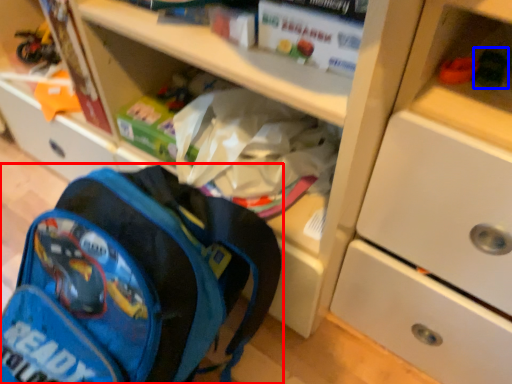
Question: Which object is further to the camera taking this photo, backpack (highlighted by a red box) or toy (highlighted by a blue box)?

Choices:
 (A) backpack
 (B) toy

Answer: (B)